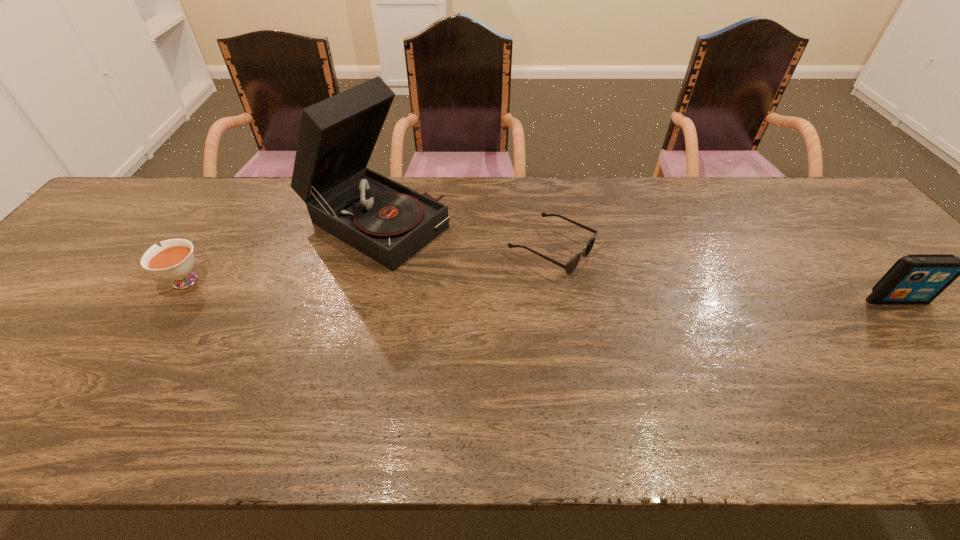
At what (x,y) coordinates should I click in order to perform the action: click on free space on the desktop that is between the second shortest object and the iPod and is positioned on the front-facing side of the tallest object. Please return your answer as a coordinate pair (x, y). Image resolution: width=960 pixels, height=540 pixels. Looking at the image, I should click on (498, 289).

In order to click on free spot on the desktop that is between the leftmost object and the rightmost object and is positioned on the front lenses of the shortest object in this screenshot , I will do `click(639, 293)`.